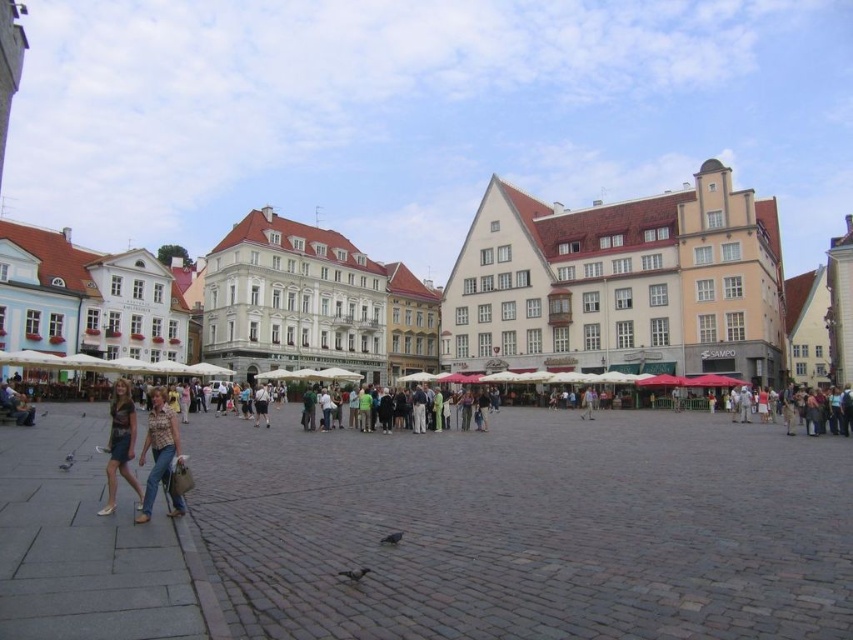
Question: In this image, where is denim jeans at lower left located relative to denim skirt at lower left?

Choices:
 (A) above
 (B) below

Answer: (B)

Question: Is white textured building at center closer to camera compared to denim jeans at lower left?

Choices:
 (A) yes
 (B) no

Answer: (B)

Question: In this image, where is denim jeans at lower left located relative to denim skirt at lower left?

Choices:
 (A) left
 (B) right

Answer: (B)

Question: Considering the real-world distances, which object is farthest from the denim jeans at lower left?

Choices:
 (A) denim skirt at lower left
 (B) white textured building at center

Answer: (B)

Question: Which point is farther to the camera?

Choices:
 (A) (461, 256)
 (B) (171, 460)
 (C) (120, 468)

Answer: (A)

Question: Which point is closer to the camera?

Choices:
 (A) denim skirt at lower left
 (B) white textured building at center
 (C) denim jeans at lower left

Answer: (C)